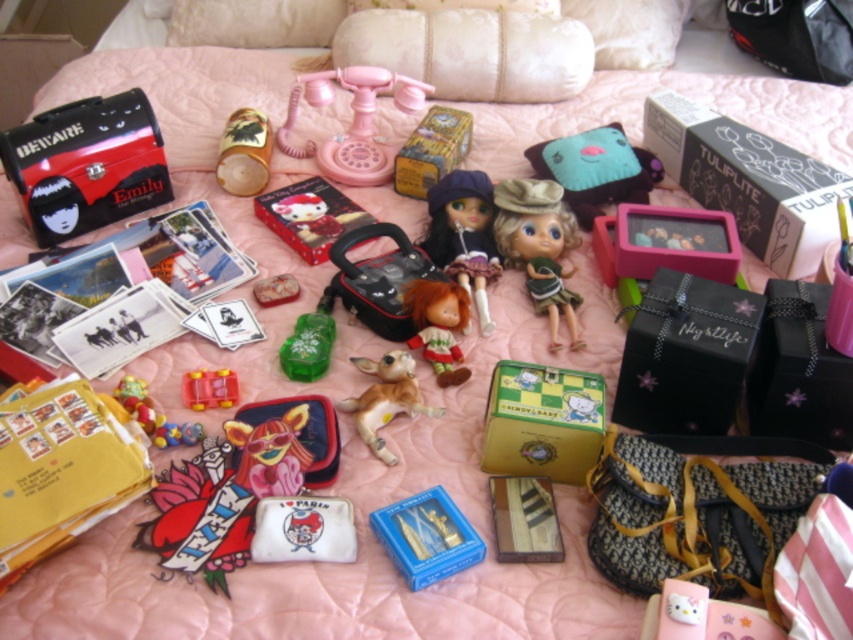
You are organizing the items on the bed and need to place both the creamy satin pillow at upper center and the pink plastic telephone at center. Given their sizes, which item should you move first to make space for the other?

The creamy satin pillow at upper center occupies less space than the pink plastic telephone at center, so you should move the pink plastic telephone at center first to make space for the smaller item.

You are organizing a display on a shelf and need to place the matte purple doll at center and the brown matte toy dog at center. Given that the shelf has limited vertical space, which item should you place first to ensure both fit vertically?

The matte purple doll at center is above the brown matte toy dog at center in the current arrangement. To fit both vertically on the shelf with limited space, you should place the brown matte toy dog at center first, then position the matte purple doll at center above it to maintain the vertical order and ensure they both fit.